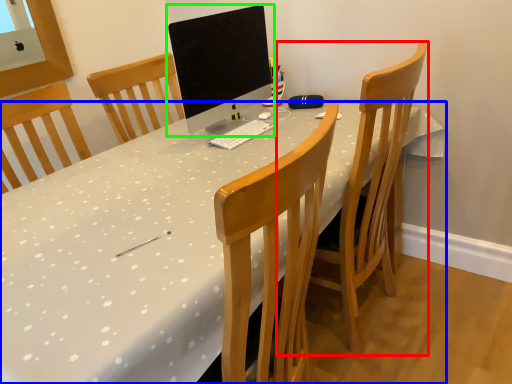
Question: Which object is positioned farthest from chair (highlighted by a red box)? Select from desk (highlighted by a blue box) and computer monitor (highlighted by a green box).

Choices:
 (A) desk
 (B) computer monitor

Answer: (B)